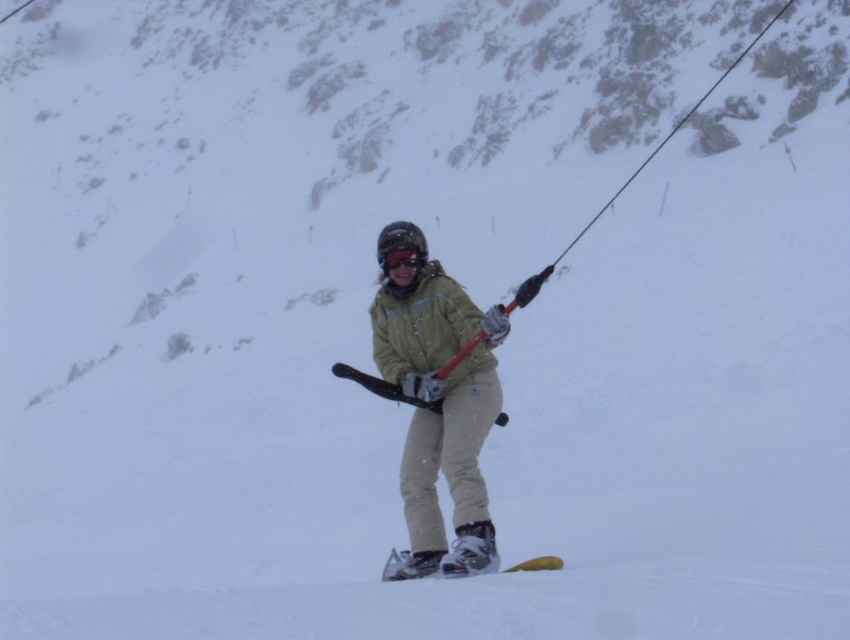
You are a photographer trying to capture the snowboarder in the image. You want to focus on the point closer to the camera between the two points labeled as point (x=367, y=385) and point (x=414, y=246). Which point should you aim your camera at?

You should aim your camera at point (x=367, y=385) because it is closer to the camera compared to point (x=414, y=246).

You are a snowboard instructor observing a student wearing a green jacket and holding a red and black tow rope. You notice the matte black ski at center and the matte black goggles at center. Which object is positioned lower in the image?

The matte black ski at center is positioned below the matte black goggles at center, so the ski is lower in the image.